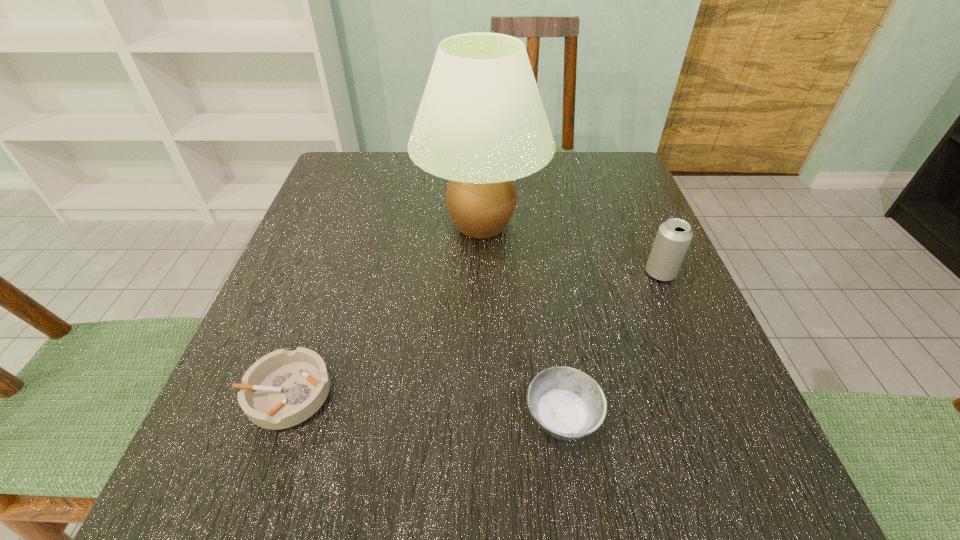
Where is `vacant space that satisfies the following two spatial constraints: 1. on the shade of the right ashtray; 2. on the left side of the lampshade`? vacant space that satisfies the following two spatial constraints: 1. on the shade of the right ashtray; 2. on the left side of the lampshade is located at coordinates (482, 417).

Locate an element on the screen. The height and width of the screenshot is (540, 960). vacant space that satisfies the following two spatial constraints: 1. on the shade of the second tallest object; 2. on the right side of the lampshade is located at coordinates (481, 273).